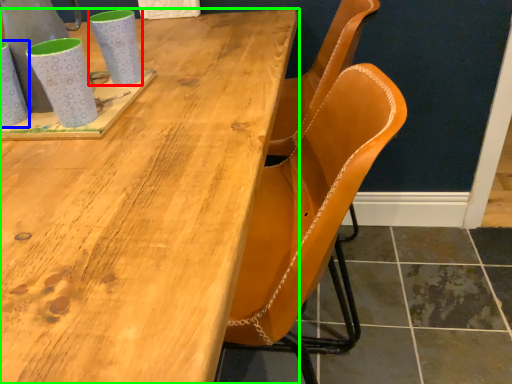
Question: Estimate the real-world distances between objects in this image. Which object is closer to mug (highlighted by a red box), mug (highlighted by a blue box) or table (highlighted by a green box)?

Choices:
 (A) mug
 (B) table

Answer: (A)